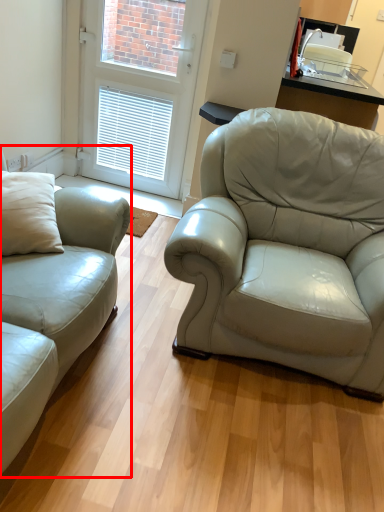
Question: From the image, what is the correct spatial relationship of studio couch (annotated by the red box) in relation to door?

Choices:
 (A) right
 (B) left

Answer: (B)